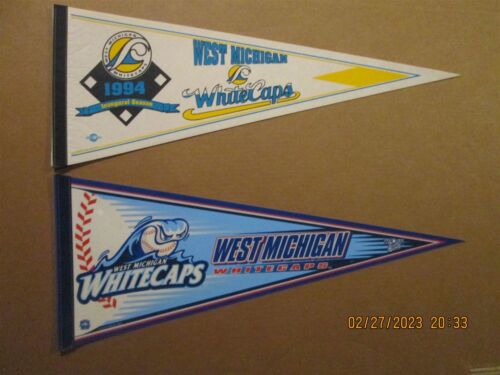
Locate an element on the screen. wall is located at coordinates coord(402,166).